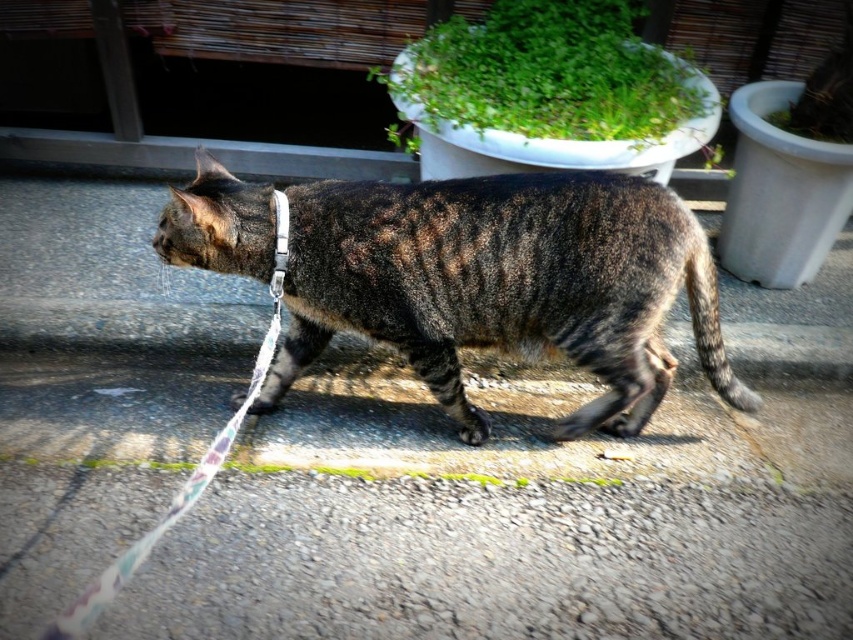
Based on the scene, if you were standing where the leash starts at the bottom left corner, which object would be closer to you, the striped fur cat at center or the green leafy plant at upper center?

The striped fur cat at center is closer to you because it is positioned under the green leafy plant at upper center, meaning the cat is in front of the plant from your perspective.

You are a gardener trying to decide where to place a new small statue. You have two options in the image, the gray asphalt at center and the green leafy plant at upper center. Which location has more space to accommodate the statue?

The gray asphalt at center is larger in size than the green leafy plant at upper center, so the gray asphalt at center has more space to accommodate the statue.